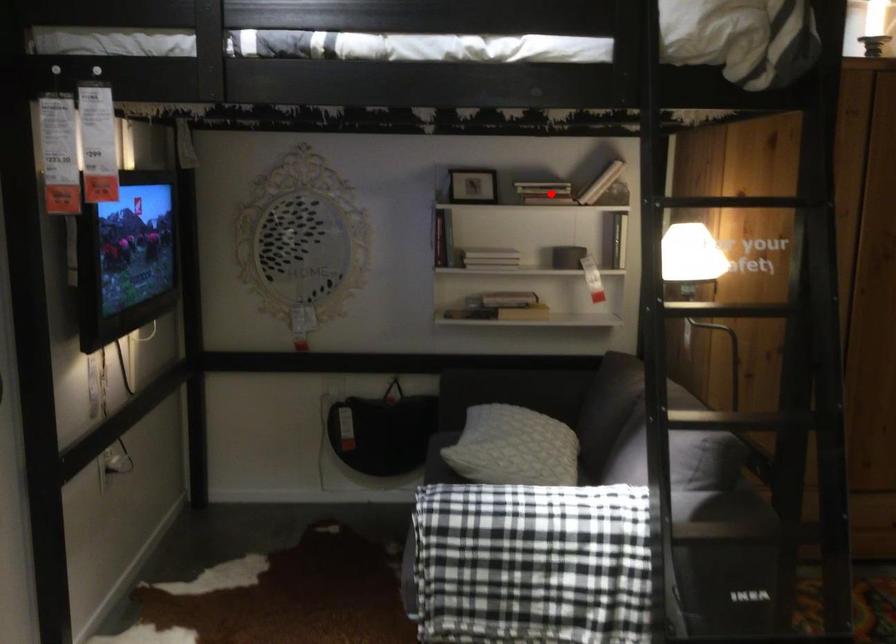
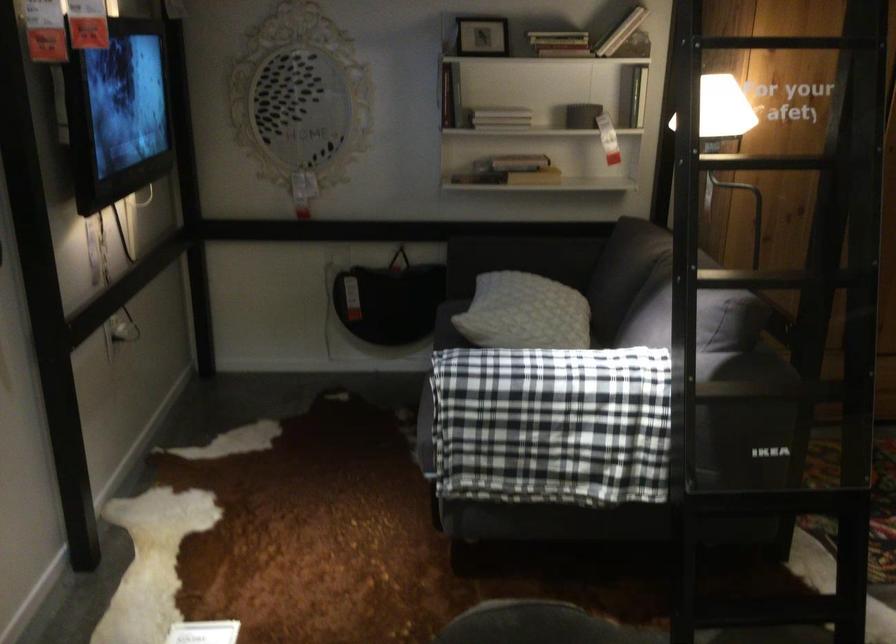
Find the pixel in the second image that matches the highlighted location in the first image.

(558, 43)